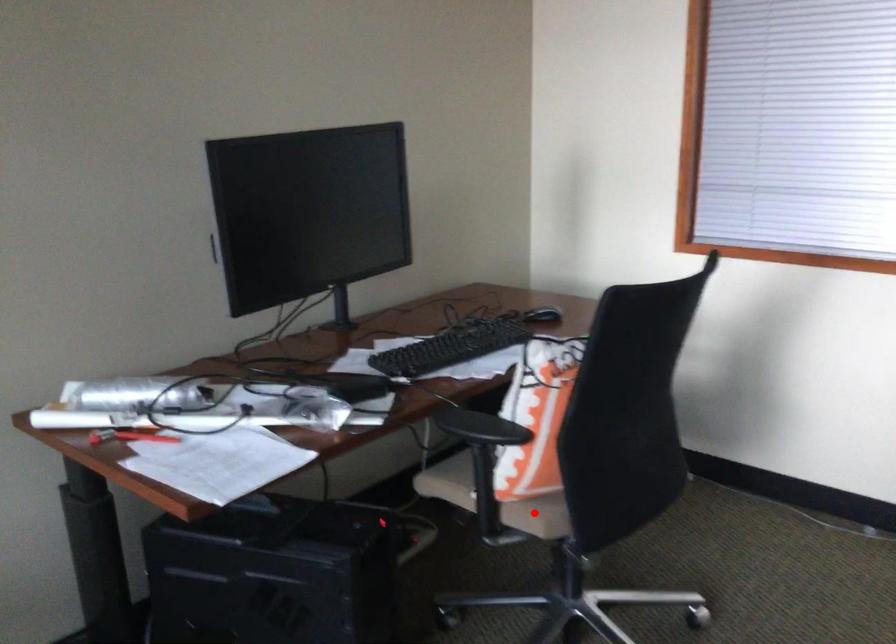
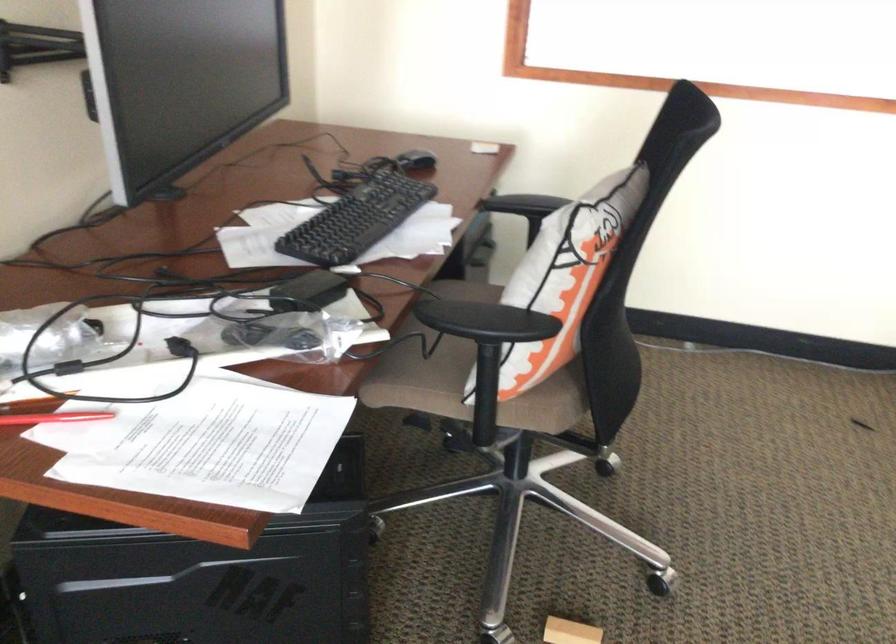
In the second image, find the point that corresponds to the highlighted location in the first image.

(543, 408)